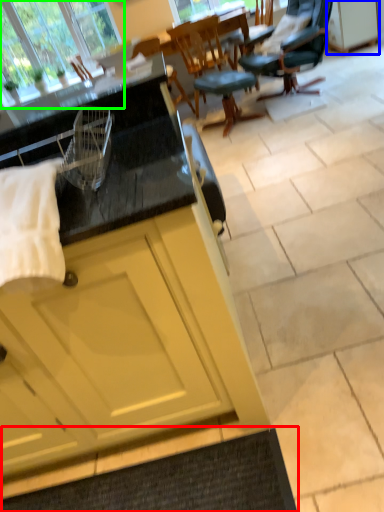
Question: Which object is positioned closest to doormat (highlighted by a red box)? Select from cabinetry (highlighted by a blue box) and window (highlighted by a green box).

Choices:
 (A) cabinetry
 (B) window

Answer: (B)